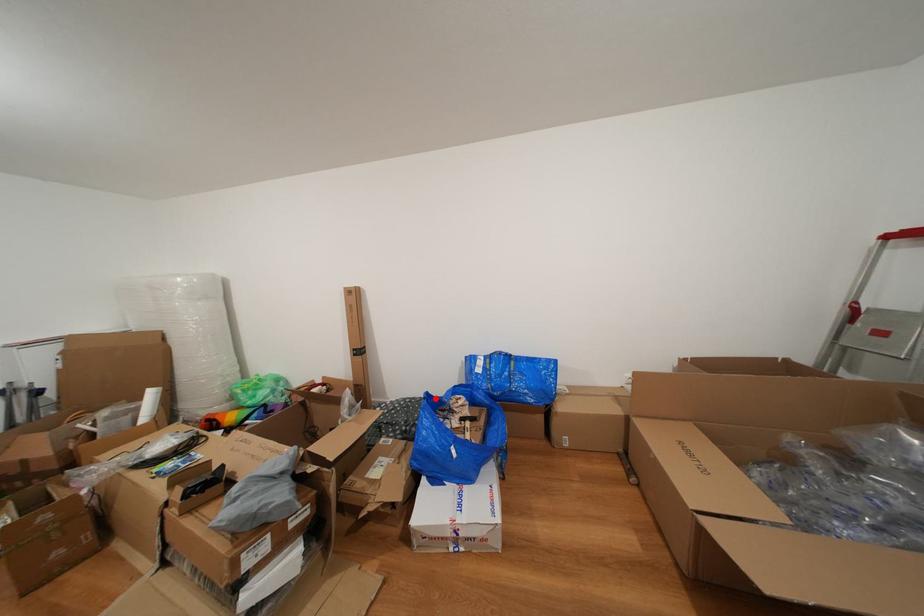
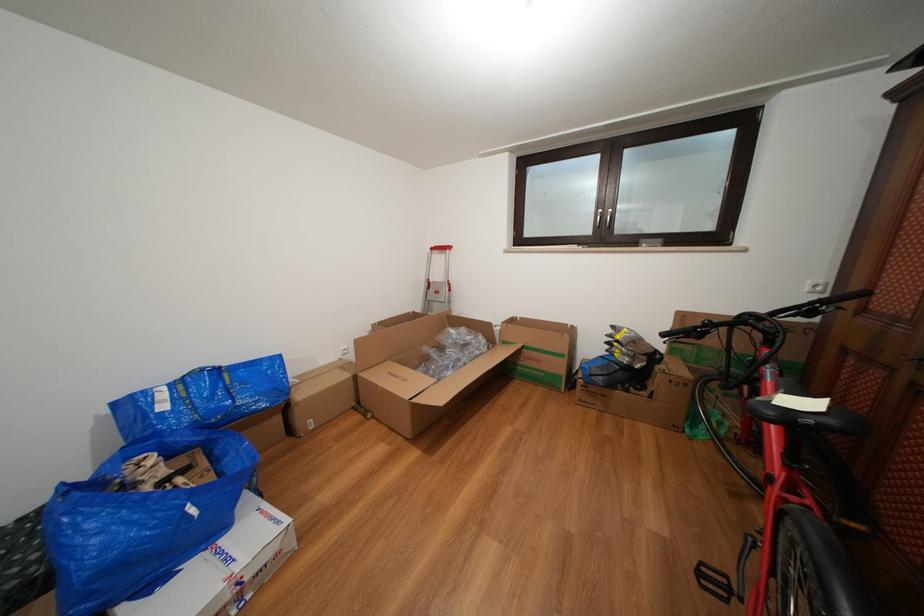
Question: I am providing you with two images of the same scene from different viewpoints. In image1, a red point is highlighted. Considering the same 3D point in image2, which of the following is correct?

Choices:
 (A) It is closer
 (B) It is farther

Answer: (A)